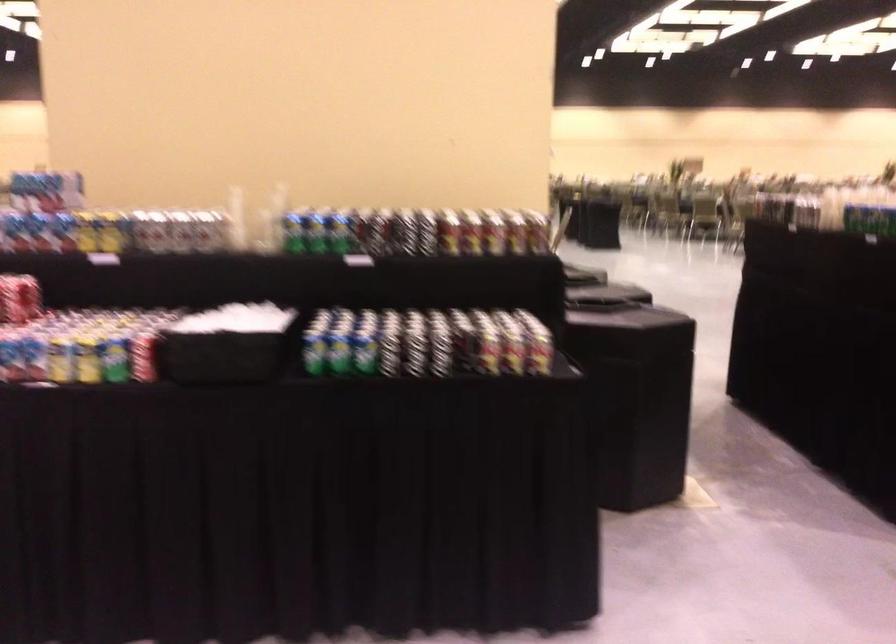
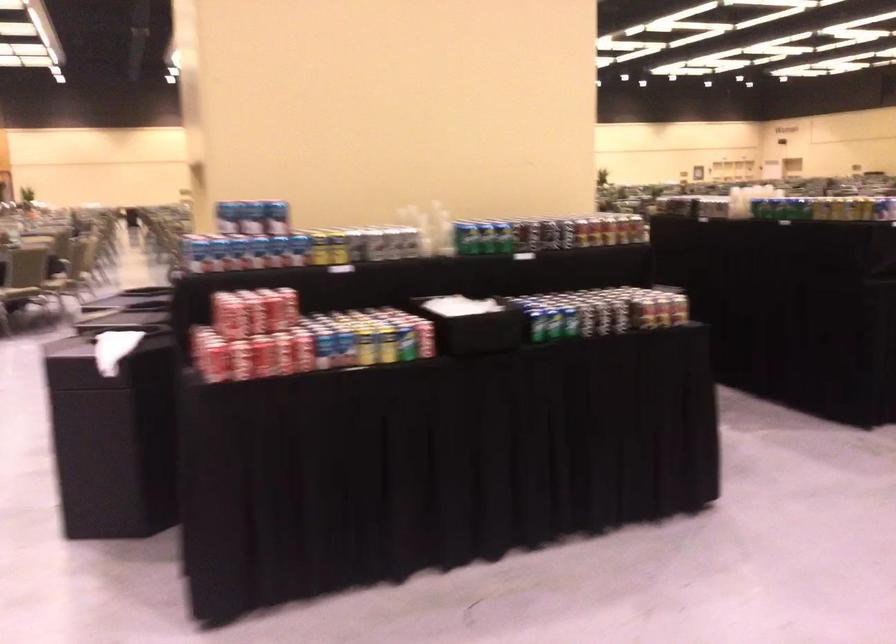
Where in the second image is the point corresponding to [366,234] from the first image?

(530, 234)